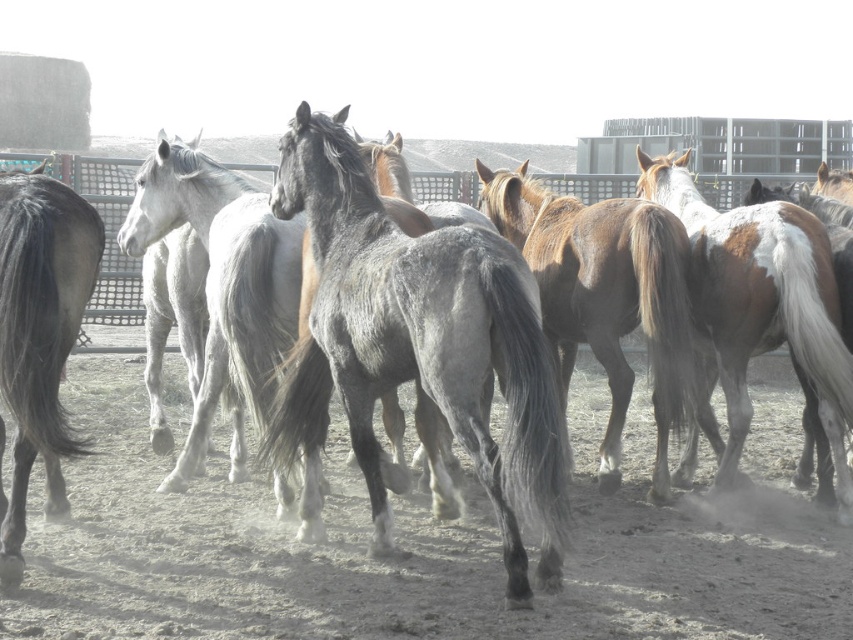
Question: Which point is farther from the camera taking this photo?

Choices:
 (A) (566, 337)
 (B) (448, 228)
 (C) (701, 234)

Answer: (A)

Question: Which is farther from the brown glossy horse at center?

Choices:
 (A) gray matte horse at left
 (B) gray dusty ground at center
 (C) gray textured horse at center

Answer: (A)

Question: Is gray dusty ground at center below gray textured horse at center?

Choices:
 (A) no
 (B) yes

Answer: (B)

Question: Among these points, which one is farthest from the camera?

Choices:
 (A) (432, 547)
 (B) (526, 212)
 (C) (70, 292)

Answer: (B)

Question: In this image, where is gray dusty ground at center located relative to gray matte horse at left?

Choices:
 (A) left
 (B) right

Answer: (B)

Question: Is brown speckled coat at right wider than gray matte horse at left?

Choices:
 (A) yes
 (B) no

Answer: (A)